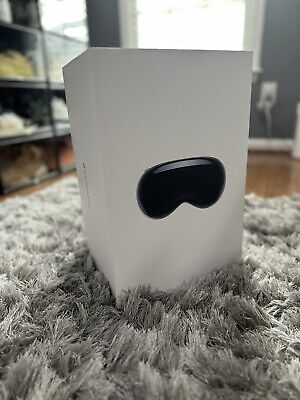
What are the coordinates of `back wall` in the screenshot? It's located at (277, 41), (111, 19).